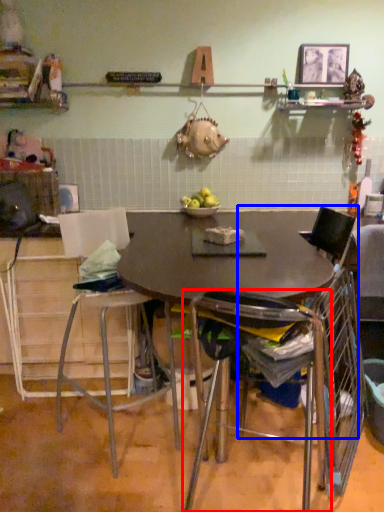
Question: Which object appears farthest to the camera in this image, chair (highlighted by a red box) or chair (highlighted by a blue box)?

Choices:
 (A) chair
 (B) chair

Answer: (B)